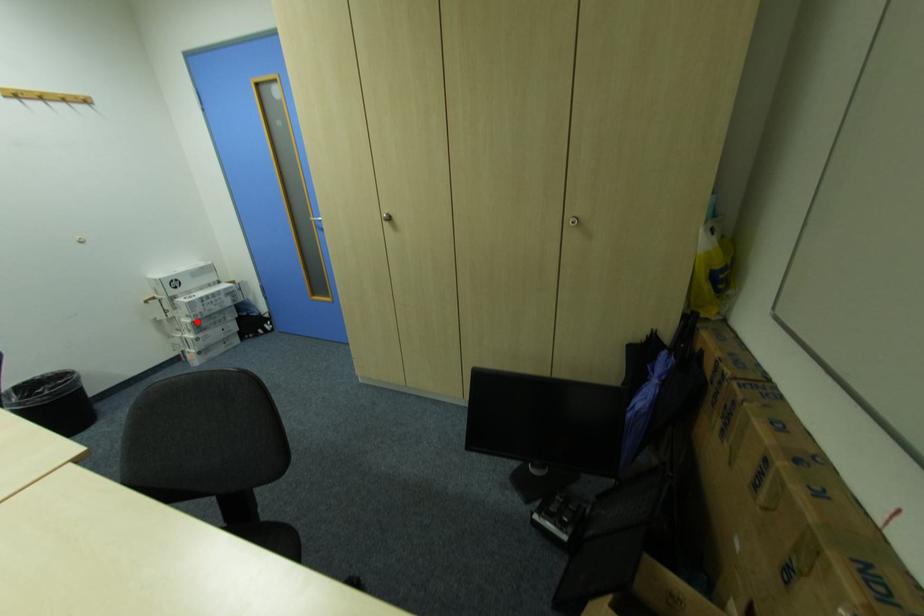
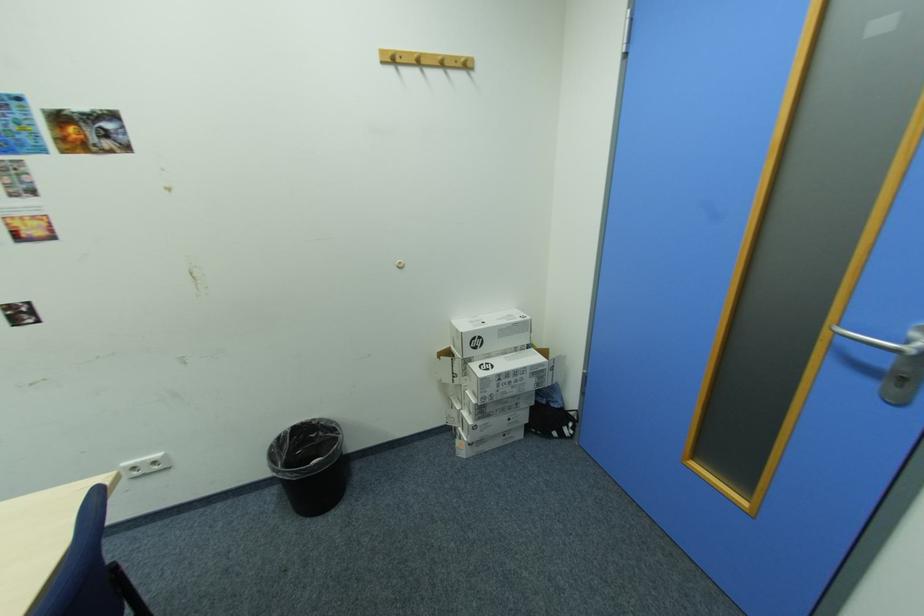
Question: I am providing you with two images of the same scene from different viewpoints. In image1, a red point is highlighted. Considering the same 3D point in image2, which of the following is correct?

Choices:
 (A) It is closer
 (B) It is farther

Answer: (B)